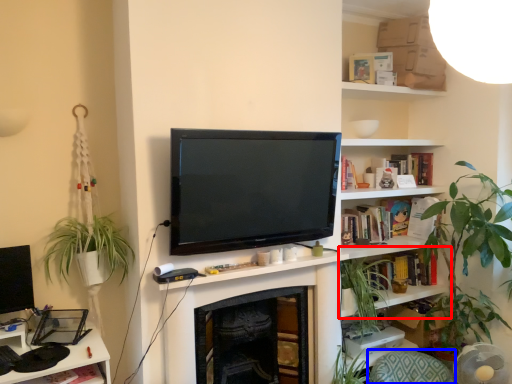
Question: Among these objects, which one is farthest to the camera, shelf (highlighted by a red box) or swivel chair (highlighted by a blue box)?

Choices:
 (A) shelf
 (B) swivel chair

Answer: (A)